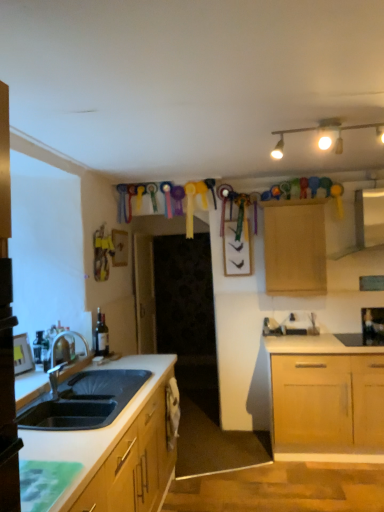
Question: Can black glass wine bottle at upper right be found inside matte glass bottle at sink left?

Choices:
 (A) yes
 (B) no

Answer: (B)

Question: Considering the relative sizes of matte glass bottle at sink left and black glass wine bottle at upper right in the image provided, is matte glass bottle at sink left thinner than black glass wine bottle at upper right?

Choices:
 (A) yes
 (B) no

Answer: (B)

Question: Is matte glass bottle at sink left directly adjacent to black glass wine bottle at upper right?

Choices:
 (A) yes
 (B) no

Answer: (B)

Question: Is matte glass bottle at sink left outside black glass wine bottle at upper right?

Choices:
 (A) no
 (B) yes

Answer: (B)

Question: From the image's perspective, is matte glass bottle at sink left located beneath black glass wine bottle at upper right?

Choices:
 (A) no
 (B) yes

Answer: (A)

Question: Considering the relative sizes of matte glass bottle at sink left and black glass wine bottle at upper right in the image provided, is matte glass bottle at sink left bigger than black glass wine bottle at upper right?

Choices:
 (A) yes
 (B) no

Answer: (B)

Question: From the image's perspective, does wooden cabinet at upper center appear lower than matte gold track lights at upper center?

Choices:
 (A) yes
 (B) no

Answer: (A)

Question: Can we say wooden cabinet at upper center lies outside matte gold track lights at upper center?

Choices:
 (A) yes
 (B) no

Answer: (A)

Question: Considering the relative sizes of wooden cabinet at upper center and matte gold track lights at upper center in the image provided, is wooden cabinet at upper center taller than matte gold track lights at upper center?

Choices:
 (A) no
 (B) yes

Answer: (B)

Question: From the image's perspective, is wooden cabinet at upper center located above matte gold track lights at upper center?

Choices:
 (A) yes
 (B) no

Answer: (B)

Question: Is wooden cabinet at upper center positioned with its back to matte gold track lights at upper center?

Choices:
 (A) no
 (B) yes

Answer: (A)

Question: Is wooden cabinet at upper center shorter than matte gold track lights at upper center?

Choices:
 (A) yes
 (B) no

Answer: (B)

Question: Can you confirm if wooden cabinet at upper center is thinner than matte white exhaust hood at upper right?

Choices:
 (A) no
 (B) yes

Answer: (B)